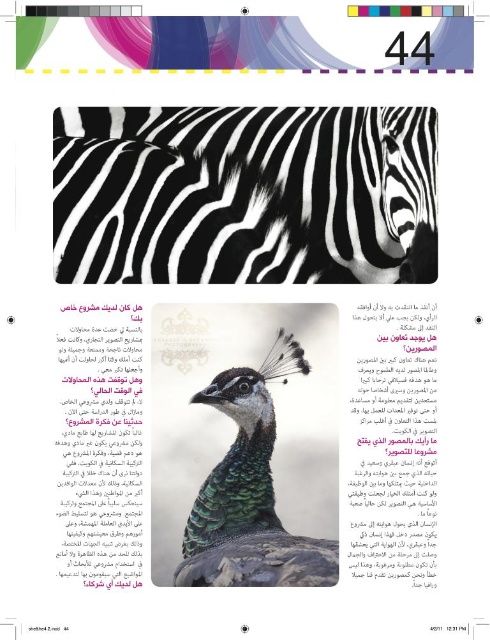
You are designing a poster and need to arrange the black and white stripes at center and the shiny green peacock at center. Based on their sizes, which object should be placed lower to maintain visual balance?

The black and white stripes at center has a lesser height compared to the shiny green peacock at center, so placing the black and white stripes at center lower down would help balance the composition since it is shorter.